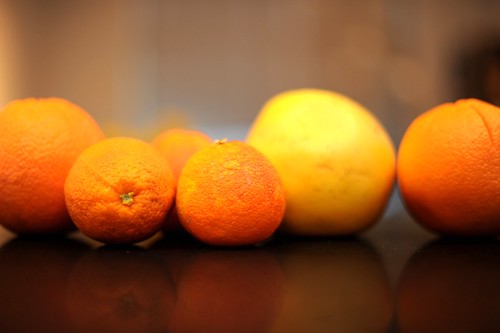
The width and height of the screenshot is (500, 333). I want to click on shadow of apple on table, so click(329, 274).